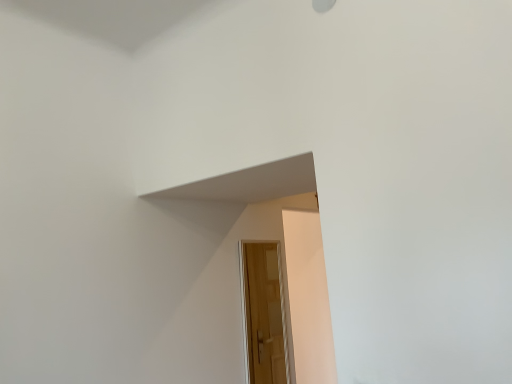
What do you see at coordinates (264, 314) in the screenshot?
I see `light brown wooden door at center` at bounding box center [264, 314].

You are a GUI agent. You are given a task and a screenshot of the screen. Output one action in this format:
    pyautogui.click(x=<x>, y=<y>)
    Task: Click on the light brown wooden door at center
    The width and height of the screenshot is (512, 384).
    Given the screenshot: What is the action you would take?
    pyautogui.click(x=264, y=314)

At what (x,y) coordinates should I click in order to perform the action: click on light brown wooden door at center. Please return your answer as a coordinate pair (x, y). Looking at the image, I should click on (264, 314).